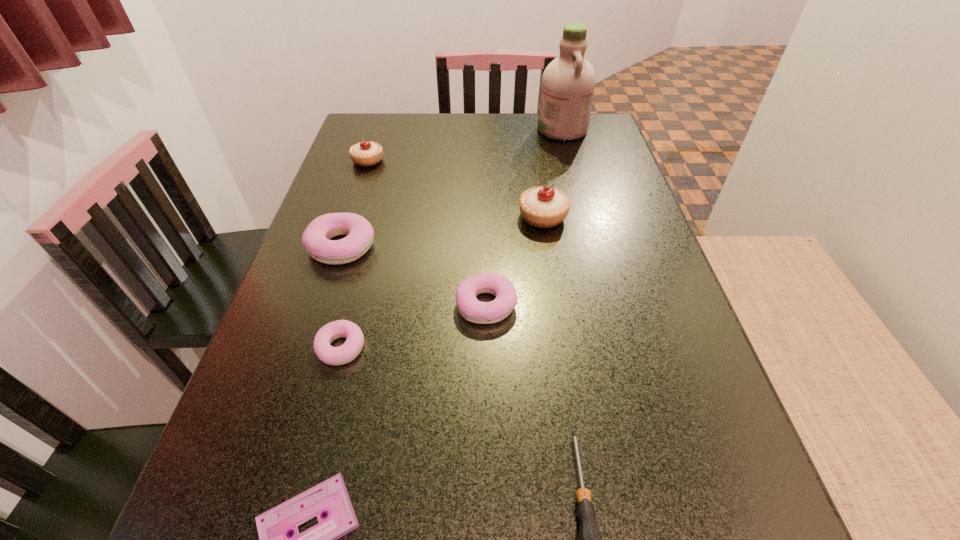
Identify the location of cleansing agent. The width and height of the screenshot is (960, 540). (568, 83).

Find the location of a particular element. This screenshot has height=540, width=960. the farthest object is located at coordinates (568, 83).

Find the location of a particular element. The height and width of the screenshot is (540, 960). the bigger beige pastry is located at coordinates (544, 207).

Where is `the nearer beige pastry`? The width and height of the screenshot is (960, 540). the nearer beige pastry is located at coordinates (544, 207).

Identify the location of the sixth shortest object. (366, 153).

Find the location of a particular element. the smaller beige pastry is located at coordinates (366, 153).

The width and height of the screenshot is (960, 540). Find the location of `the fifth shortest object`. the fifth shortest object is located at coordinates (316, 238).

Image resolution: width=960 pixels, height=540 pixels. Find the location of `the third shortest pastry`. the third shortest pastry is located at coordinates pos(316,238).

In order to click on the fourth shortest object in this screenshot , I will do `click(473, 310)`.

I want to click on the second biggest pink pastry, so click(473, 310).